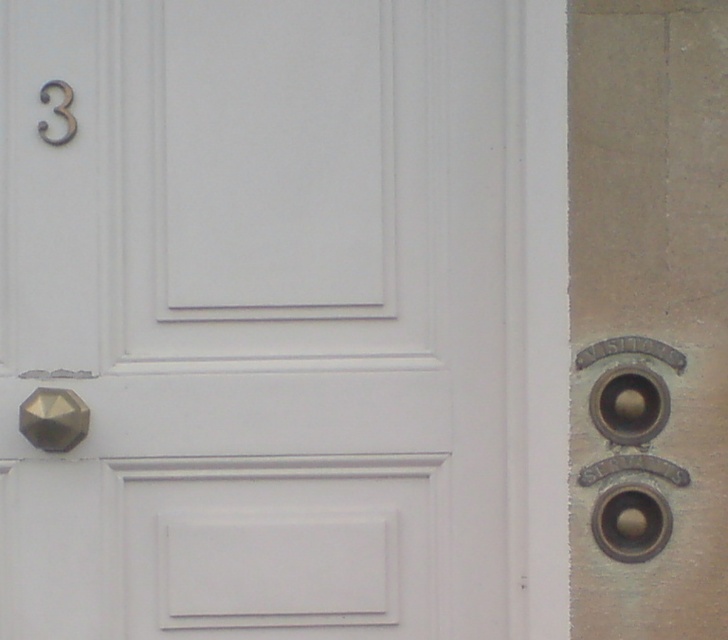
Question: Which point is closer to the camera taking this photo?

Choices:
 (A) (94, 584)
 (B) (50, 413)

Answer: (B)

Question: Is polished brass knob at lower left bigger than matte gold door handle at upper left?

Choices:
 (A) no
 (B) yes

Answer: (B)

Question: Is polished brass knob at lower left further to the viewer compared to matte gold door handle at upper left?

Choices:
 (A) yes
 (B) no

Answer: (B)

Question: Which object is positioned closest to the polished brass knob at lower left?

Choices:
 (A) white matte door at center
 (B) matte gold door handle at upper left

Answer: (A)

Question: In this image, where is polished brass knob at lower left located relative to matte gold door handle at upper left?

Choices:
 (A) below
 (B) above

Answer: (A)

Question: Based on their relative distances, which object is nearer to the matte gold door handle at upper left?

Choices:
 (A) white matte door at center
 (B) polished brass knob at lower left

Answer: (B)